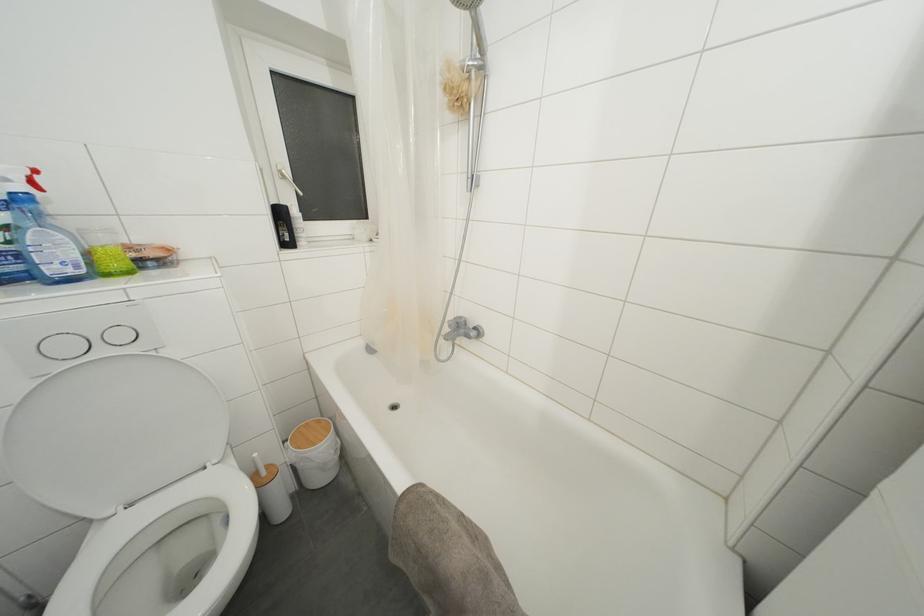
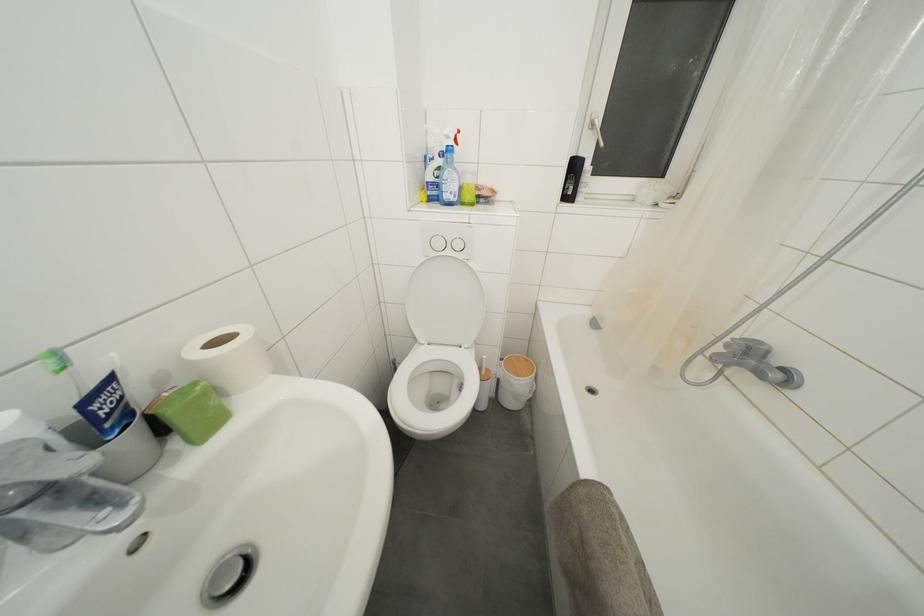
Where in the second image is the point corresponding to point (71, 352) from the first image?

(443, 249)